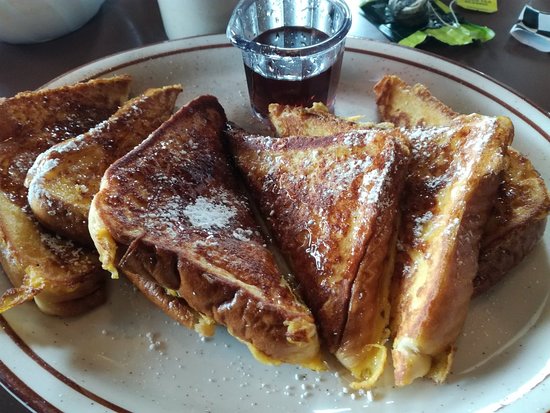
This screenshot has height=413, width=550. In order to click on clear dish in this screenshot , I will do `click(287, 13)`.